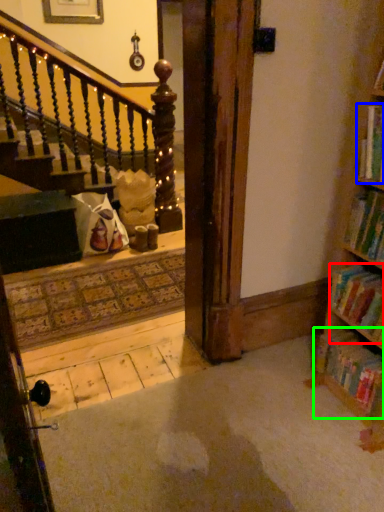
Question: Based on their relative distances, which object is nearer to book (highlighted by a red box)? Choose from book (highlighted by a blue box) and book (highlighted by a green box).

Choices:
 (A) book
 (B) book

Answer: (B)